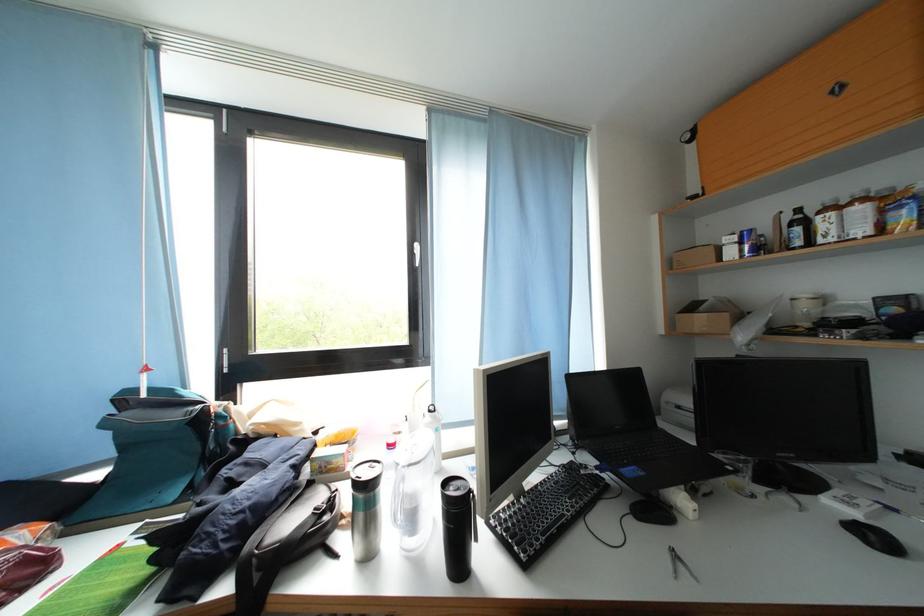
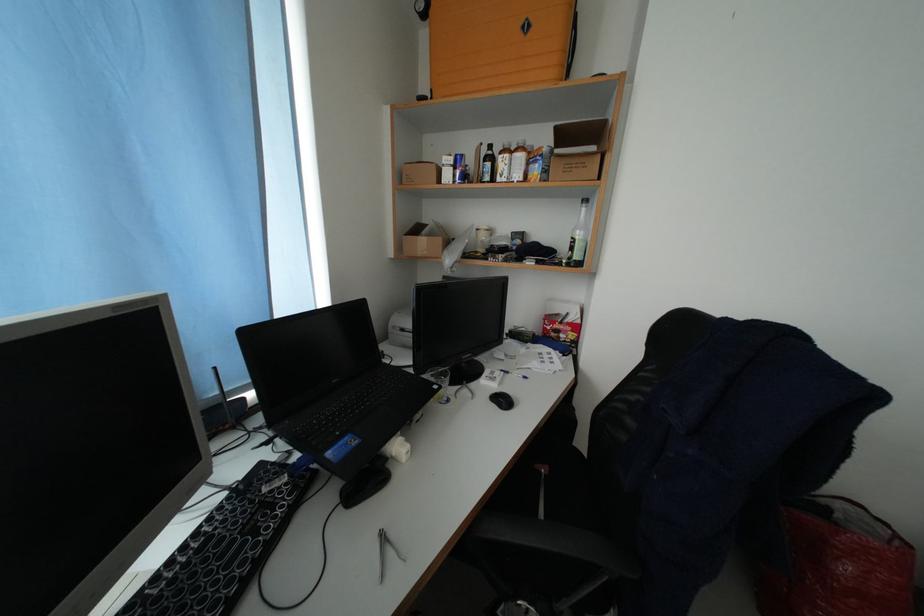
The point at (x=748, y=248) is marked in the first image. Where is the corresponding point in the second image?

(464, 172)